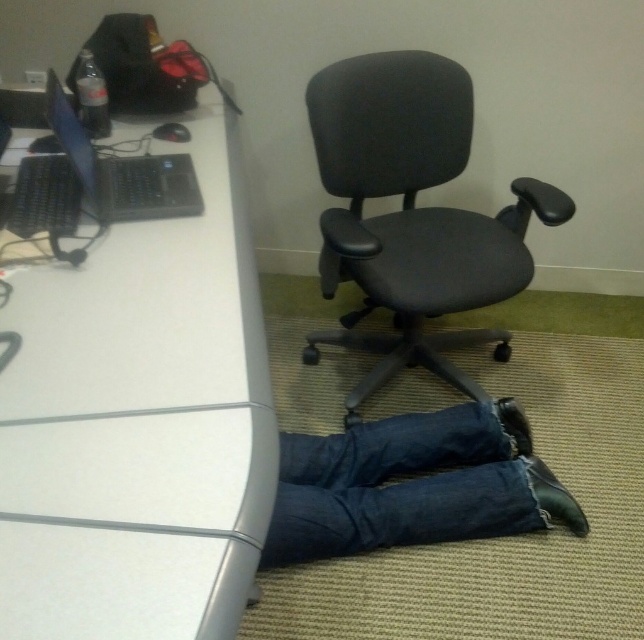
Question: Which object appears farthest from the camera in this image?

Choices:
 (A) white glossy computer desk at upper left
 (B) black leather shoe at lower right
 (C) denim at lower center

Answer: (B)

Question: Which point appears farthest from the camera in this image?

Choices:
 (A) (53, 115)
 (B) (53, 624)

Answer: (A)

Question: Can you confirm if white glossy computer desk at upper left is smaller than denim at lower center?

Choices:
 (A) no
 (B) yes

Answer: (A)

Question: Which point is closer to the camera?

Choices:
 (A) (317, 536)
 (B) (504, 417)
 (C) (43, 625)

Answer: (C)

Question: Is black leather shoe at lower right positioned at the back of blue denim jeans at lower center?

Choices:
 (A) yes
 (B) no

Answer: (B)

Question: Is denim at lower center to the left of blue denim jeans at lower center from the viewer's perspective?

Choices:
 (A) no
 (B) yes

Answer: (B)